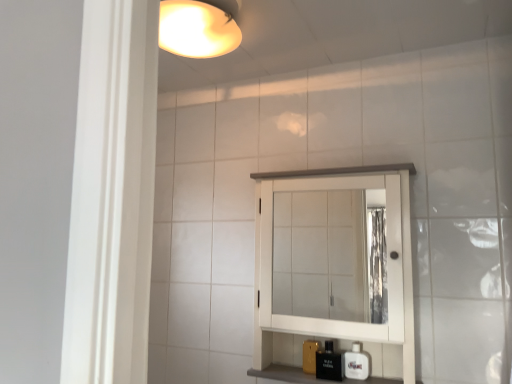
Question: Is white glossy soap dispenser at lower right not inside white wood medicine cabinet at center?

Choices:
 (A) yes
 (B) no

Answer: (B)

Question: Considering the relative sizes of white glossy soap dispenser at lower right and white wood medicine cabinet at center in the image provided, is white glossy soap dispenser at lower right taller than white wood medicine cabinet at center?

Choices:
 (A) no
 (B) yes

Answer: (A)

Question: Is white glossy soap dispenser at lower right not close to white wood medicine cabinet at center?

Choices:
 (A) yes
 (B) no

Answer: (B)

Question: Can you confirm if white glossy soap dispenser at lower right is wider than white wood medicine cabinet at center?

Choices:
 (A) yes
 (B) no

Answer: (B)

Question: From the image's perspective, is white glossy soap dispenser at lower right under white wood medicine cabinet at center?

Choices:
 (A) yes
 (B) no

Answer: (A)

Question: Is the surface of white glossy soap dispenser at lower right in direct contact with white wood medicine cabinet at center?

Choices:
 (A) no
 (B) yes

Answer: (A)

Question: Is white glossy soap dispenser at lower right to the right of black glossy bottle at lower center from the viewer's perspective?

Choices:
 (A) no
 (B) yes

Answer: (B)

Question: Is white glossy soap dispenser at lower right shorter than black glossy bottle at lower center?

Choices:
 (A) no
 (B) yes

Answer: (B)

Question: Is white glossy soap dispenser at lower right closer to camera compared to black glossy bottle at lower center?

Choices:
 (A) no
 (B) yes

Answer: (A)

Question: Considering the relative positions of white glossy soap dispenser at lower right and black glossy bottle at lower center in the image provided, is white glossy soap dispenser at lower right to the left of black glossy bottle at lower center from the viewer's perspective?

Choices:
 (A) no
 (B) yes

Answer: (A)

Question: Does white glossy soap dispenser at lower right have a smaller size compared to black glossy bottle at lower center?

Choices:
 (A) yes
 (B) no

Answer: (A)

Question: Does white glossy soap dispenser at lower right come behind black glossy bottle at lower center?

Choices:
 (A) no
 (B) yes

Answer: (B)

Question: Does white wood medicine cabinet at center have a greater width compared to black glossy bottle at lower center?

Choices:
 (A) no
 (B) yes

Answer: (B)